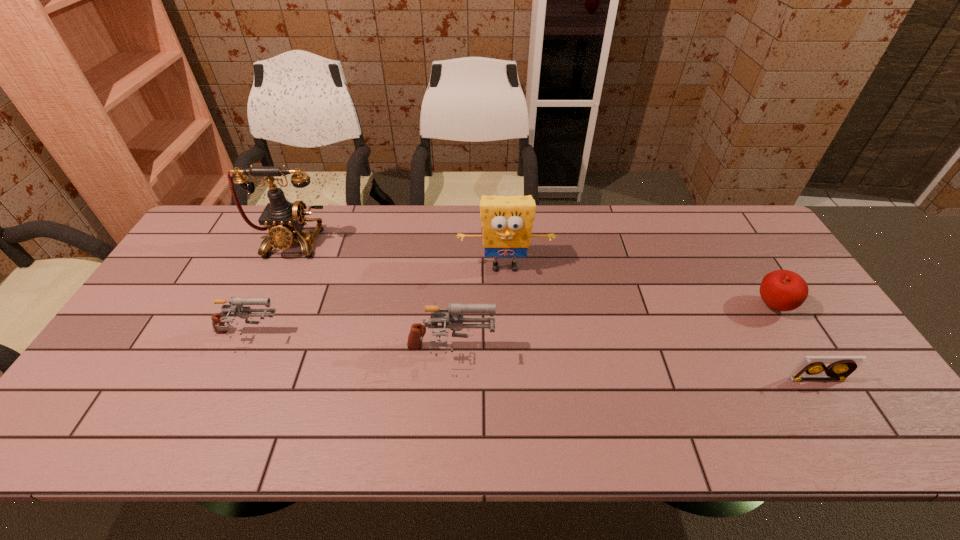
Locate an element on the screen. The height and width of the screenshot is (540, 960). free spot located 0.210m on the front of the telephone, featuring the rotary dial is located at coordinates (259, 312).

Locate an element on the screen. vacant space situated 0.280m on the left of the apple is located at coordinates (654, 306).

What are the coordinates of `vacant point located 0.220m on the face of the sponge` in the screenshot? It's located at (509, 340).

The image size is (960, 540). In order to click on object located in the far edge section of the desktop in this screenshot , I will do `click(285, 220)`.

Find the location of a particular element. gun located at the near edge is located at coordinates (454, 322).

Find the location of a particular element. The image size is (960, 540). videotape that is at the near edge is located at coordinates (813, 367).

At what (x,y) coordinates should I click in order to perform the action: click on apple that is at the right edge. Please return your answer as a coordinate pair (x, y). Looking at the image, I should click on point(782,290).

Find the location of `videotape situated at the right edge`. videotape situated at the right edge is located at coordinates coord(813,367).

At what (x,y) coordinates should I click in order to perform the action: click on object located at the near right corner. Please return your answer as a coordinate pair (x, y). Image resolution: width=960 pixels, height=540 pixels. Looking at the image, I should click on (813, 367).

What are the coordinates of `blank space at the far edge of the desktop` in the screenshot? It's located at (693, 239).